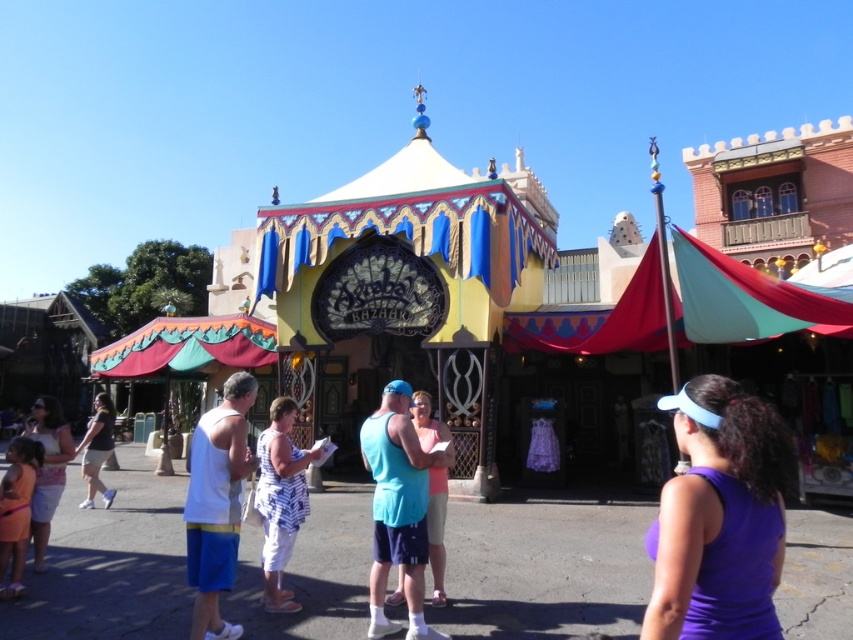
Between point (260, 460) and point (7, 448), which one is positioned in front?

Positioned in front is point (260, 460).

Looking at this image, can you confirm if white printed dress at center is positioned above orange cotton dress at lower left?

Indeed, white printed dress at center is positioned over orange cotton dress at lower left.

Does point (265, 568) lie behind point (13, 509)?

No, (265, 568) is closer to viewer.

At what (x,y) coordinates should I click in order to perform the action: click on white printed dress at center. Please return your answer as a coordinate pair (x, y). This screenshot has width=853, height=640. Looking at the image, I should click on (280, 499).

Who is lower down, white tank top at center or denim shorts at left?

denim shorts at left is lower down.

At what (x,y) coordinates should I click in order to perform the action: click on white tank top at center. Please return your answer as a coordinate pair (x, y). The width and height of the screenshot is (853, 640). Looking at the image, I should click on (218, 502).

Who is more distant from viewer, (231,436) or (105,394)?

The point (105,394) is behind.

Find the location of a particular element. white tank top at center is located at coordinates (218, 502).

Is red fabric canopy at center to the left of white printed dress at center from the viewer's perspective?

No, red fabric canopy at center is not to the left of white printed dress at center.

Describe the element at coordinates (688, 307) in the screenshot. Image resolution: width=853 pixels, height=640 pixels. I see `red fabric canopy at center` at that location.

Where is `red fabric canopy at center`? red fabric canopy at center is located at coordinates (688, 307).

Where is `red fabric canopy at center`? red fabric canopy at center is located at coordinates pos(688,307).